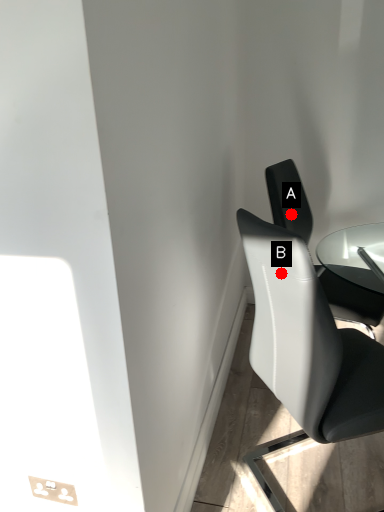
Question: Two points are circled on the image, labeled by A and B beside each circle. Among these points, which one is farthest from the camera?

Choices:
 (A) A is further
 (B) B is further

Answer: (A)